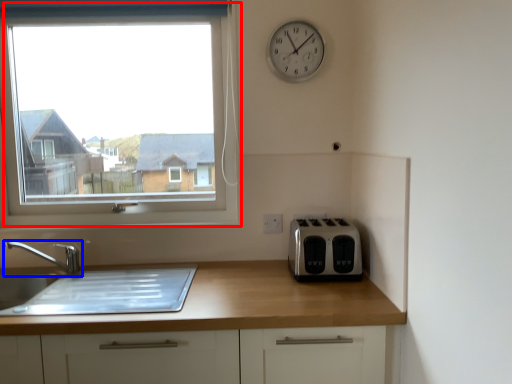
Question: Which object is closer to the camera taking this photo, window (highlighted by a red box) or tap (highlighted by a blue box)?

Choices:
 (A) window
 (B) tap

Answer: (B)